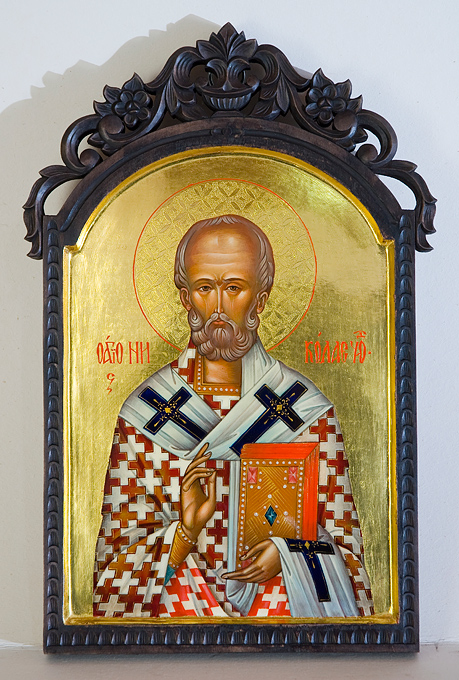
Identify the location of book. (297, 519).